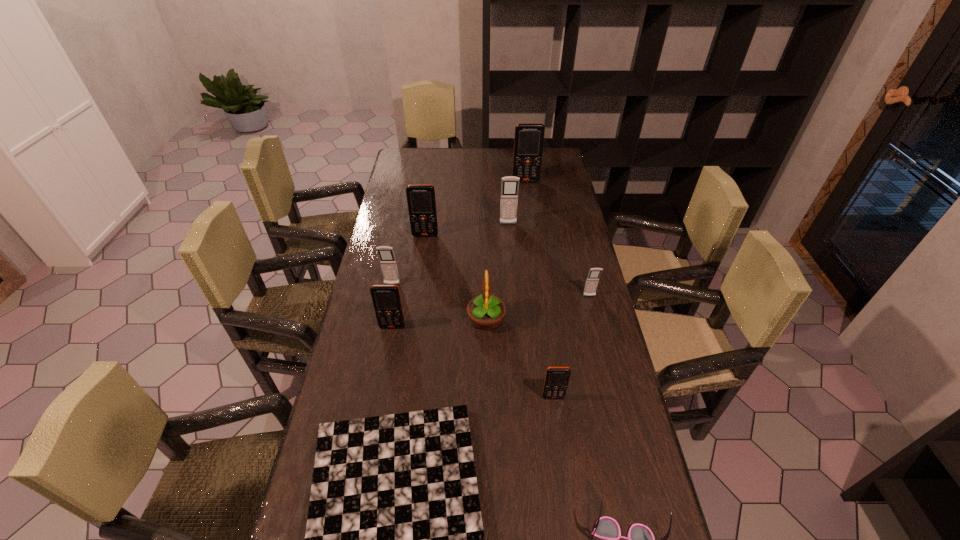
The image size is (960, 540). What are the coordinates of `free space located on the face of the yellow sunflower` in the screenshot? It's located at (404, 319).

This screenshot has height=540, width=960. Identify the location of free location located 0.250m on the front-facing side of the fourth nearest cellular telephone. (379, 347).

Locate an element on the screen. The image size is (960, 540). free spot located on the screen of the sixth farthest cellular telephone is located at coordinates (381, 386).

The height and width of the screenshot is (540, 960). I want to click on free space located 0.320m on the screen of the nearest orange cellular telephone, so click(571, 531).

What are the coordinates of `vacant space located on the front-facing side of the sixth nearest object` in the screenshot? It's located at (605, 359).

The width and height of the screenshot is (960, 540). In the image, there is a desktop. In order to click on vacant space at the far edge in this screenshot , I will do `click(438, 173)`.

Locate an element on the screen. free space at the left edge of the desktop is located at coordinates (378, 399).

Image resolution: width=960 pixels, height=540 pixels. I want to click on vacant space at the right edge, so click(x=544, y=246).

I want to click on free space at the far left corner of the desktop, so click(417, 172).

Where is `vacant area at the far right corner`? The width and height of the screenshot is (960, 540). vacant area at the far right corner is located at coordinates (550, 148).